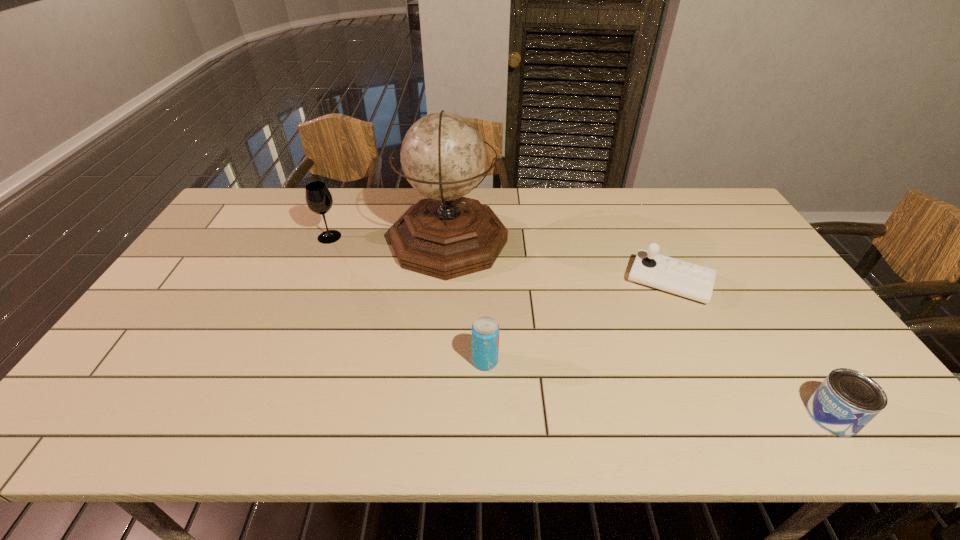
The width and height of the screenshot is (960, 540). I want to click on globe, so click(x=443, y=156).

Locate an element on the screen. the second tallest object is located at coordinates (319, 200).

What are the coordinates of `wineglass` in the screenshot? It's located at (319, 200).

Find the location of `the fourth farthest object`. the fourth farthest object is located at coordinates (485, 330).

Locate an element on the screen. The height and width of the screenshot is (540, 960). the second object from right to left is located at coordinates point(675,276).

Identify the location of can. (846, 401).

Image resolution: width=960 pixels, height=540 pixels. Find the location of `the rightmost object`. the rightmost object is located at coordinates (846, 401).

Where is `free space located on the surface of the globe`? The image size is (960, 540). free space located on the surface of the globe is located at coordinates (620, 241).

Locate an element on the screen. The height and width of the screenshot is (540, 960). free space located on the back of the second tallest object is located at coordinates (341, 208).

Locate an element on the screen. The height and width of the screenshot is (540, 960). vacant space located 0.150m on the right of the second nearest object is located at coordinates (559, 361).